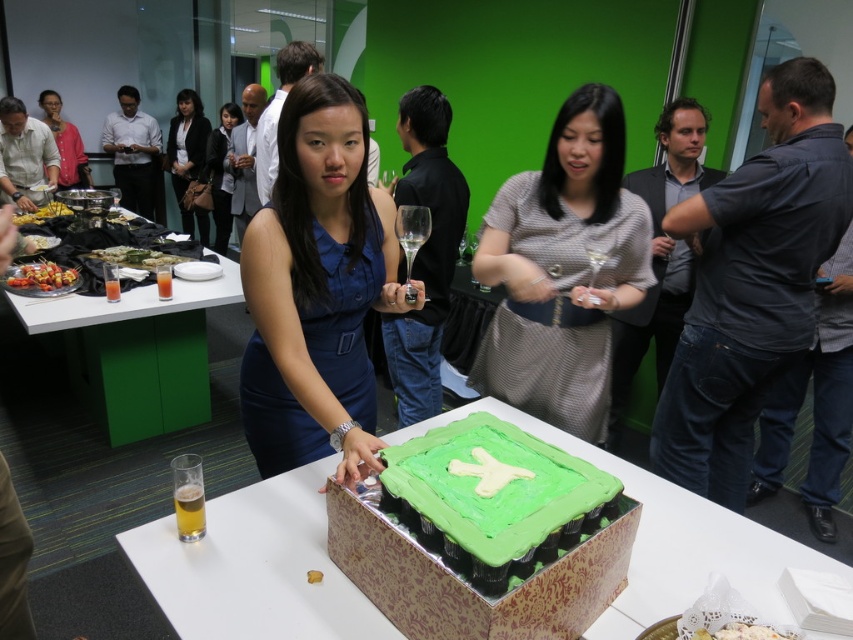
Question: Is green paperboard cake at center to the right of white creamy mashed potatoes at center from the viewer's perspective?

Choices:
 (A) no
 (B) yes

Answer: (A)

Question: Which of the following is the farthest from the observer?

Choices:
 (A) green matte skewers at left
 (B) shiny metallic skewers at left

Answer: (A)

Question: Is green paperboard cake at center below white glossy table at left?

Choices:
 (A) no
 (B) yes

Answer: (B)

Question: Which object appears farthest from the camera in this image?

Choices:
 (A) green matte sushi at center
 (B) green frosted cake at center

Answer: (A)

Question: Is dark blue dress at center thinner than shiny metallic skewers at left?

Choices:
 (A) no
 (B) yes

Answer: (A)

Question: Which object is the farthest from the blue satin dress at center?

Choices:
 (A) green matte skewers at left
 (B) dark blue dress at center

Answer: (B)